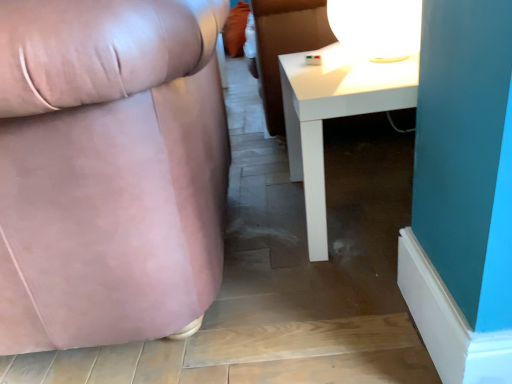
Locate an element on the screen. This screenshot has width=512, height=384. vacant region to the left of white glossy table at lower right is located at coordinates (253, 234).